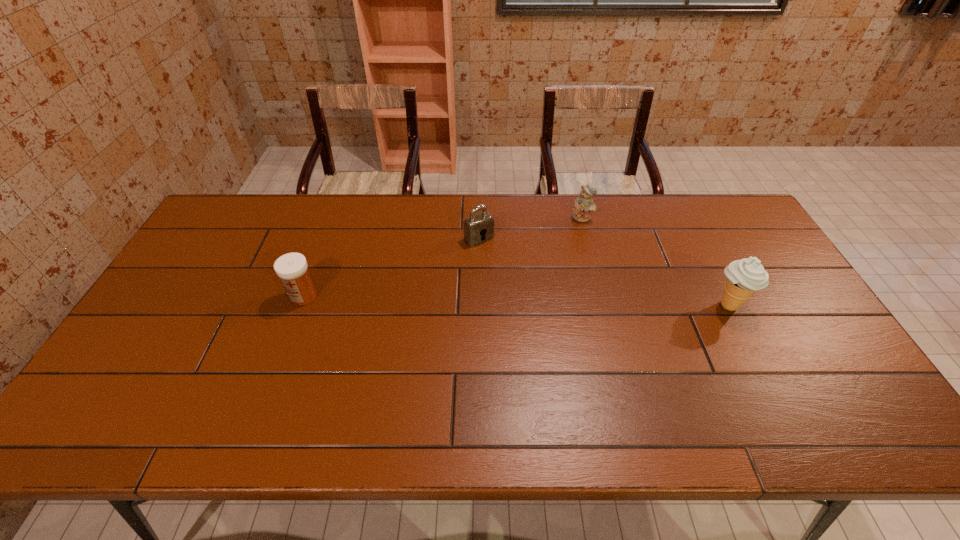
In order to click on vacant space at the left edge of the desktop in this screenshot , I will do `click(190, 293)`.

Locate an element on the screen. The image size is (960, 540). free region at the right edge of the desktop is located at coordinates (748, 303).

The image size is (960, 540). In the image, there is a desktop. Identify the location of free space at the far left corner. (246, 220).

The image size is (960, 540). In the image, there is a desktop. In order to click on free region at the near left corner in this screenshot , I will do `click(158, 379)`.

What are the coordinates of `free space between the medicine and the third object from right to left` in the screenshot? It's located at click(392, 267).

Locate an element on the screen. Image resolution: width=960 pixels, height=540 pixels. vacant point located between the leftmost object and the padlock is located at coordinates (392, 267).

At what (x,y) coordinates should I click in order to perform the action: click on free space between the second farthest object and the leftmost object. Please return your answer as a coordinate pair (x, y). This screenshot has height=540, width=960. Looking at the image, I should click on (392, 267).

Identify the location of vacant space that's between the medicine and the padlock. This screenshot has height=540, width=960. (392, 267).

At what (x,y) coordinates should I click in order to perform the action: click on empty location between the medicine and the icecream. Please return your answer as a coordinate pair (x, y). This screenshot has height=540, width=960. Looking at the image, I should click on (516, 301).

This screenshot has width=960, height=540. I want to click on vacant space in between the leftmost object and the teddy bear, so click(443, 256).